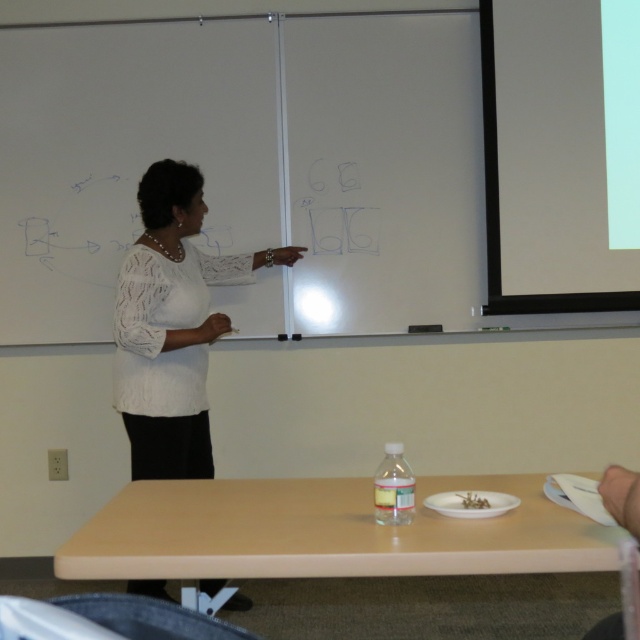
Question: Can you confirm if light brown laminate table at lower center is smaller than white lace blouse at upper center?

Choices:
 (A) yes
 (B) no

Answer: (A)

Question: Does light brown laminate table at lower center appear under white lace blouse at upper center?

Choices:
 (A) yes
 (B) no

Answer: (A)

Question: Which of the following is the closest to the observer?

Choices:
 (A) white lace blouse at upper center
 (B) white matte projection screen at upper right
 (C) light brown laminate table at lower center

Answer: (C)

Question: Can you confirm if white matte projection screen at upper right is wider than light brown laminate table at lower center?

Choices:
 (A) yes
 (B) no

Answer: (B)

Question: Among these points, which one is nearest to the camera?

Choices:
 (A) (264, 483)
 (B) (509, 116)
 (C) (193, 266)

Answer: (A)

Question: Which is nearer to the white lace blouse at upper center?

Choices:
 (A) white matte projection screen at upper right
 (B) light brown laminate table at lower center

Answer: (B)